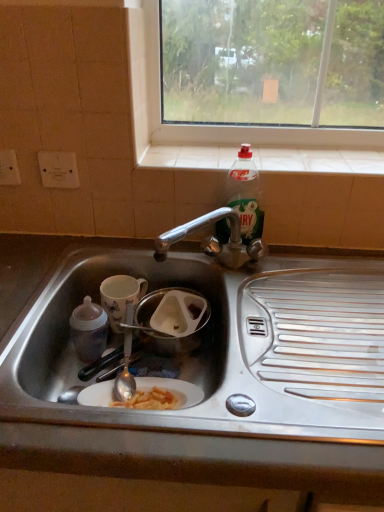
In order to face translucent plastic bottle at upper right, should I rotate leftwards or rightwards?

You should rotate right by 6.714 degrees.

This screenshot has height=512, width=384. What do you see at coordinates (245, 195) in the screenshot? I see `translucent plastic bottle at upper right` at bounding box center [245, 195].

What is the approximate width of porcelain floral mug at sink, which ranks as the first coffee cup in back-to-front order?

4.75 inches.

Locate an element on the screen. translucent plastic bottle at upper right is located at coordinates (245, 195).

Does white tile at upper center have a greater height compared to stainless steel sink at lower left?

In fact, white tile at upper center may be shorter than stainless steel sink at lower left.

Based on the photo, which object is thinner, white tile at upper center or stainless steel sink at lower left?

Thinner between the two is white tile at upper center.

From the picture: Which of these two, white tile at upper center or stainless steel sink at lower left, is smaller?

white tile at upper center.

From a real-world perspective, which is physically above, stainless steel sink at lower left or matte ceramic coffee cup at left, which is the 1th coffee cup from front to back?

matte ceramic coffee cup at left, which is the 1th coffee cup from front to back, from a real-world perspective.

Find the location of a particular element. The image size is (384, 512). the 1st coffee cup counting from the right of the stainless steel sink at lower left is located at coordinates (89, 330).

Is stainless steel sink at lower left smaller than matte ceramic coffee cup at left, which is the 1th coffee cup from front to back?

Actually, stainless steel sink at lower left might be larger than matte ceramic coffee cup at left, which is the 1th coffee cup from front to back.

Between stainless steel sink at lower left and translucent plastic bottle at upper right, which one has larger size?

stainless steel sink at lower left is bigger.

Is stainless steel sink at lower left directly adjacent to translucent plastic bottle at upper right?

No, stainless steel sink at lower left is not in contact with translucent plastic bottle at upper right.

Is point (97, 256) more distant than point (231, 196)?

Yes.

From the image's perspective, is stainless steel sink at lower left above translucent plastic bottle at upper right?

Actually, stainless steel sink at lower left appears below translucent plastic bottle at upper right in the image.

How distant is translucent plastic bottle at upper right from white tile at upper center?

Result: They are 4.81 inches apart.

Considering the positions of point (249, 214) and point (332, 152), is point (249, 214) closer or farther from the camera than point (332, 152)?

Point (249, 214) is positioned closer to the camera compared to point (332, 152).

Can you confirm if translucent plastic bottle at upper right is positioned to the right of white tile at upper center?

No.

The image size is (384, 512). Identify the location of window sill above the translucent plastic bottle at upper right (from the image's perspective). (319, 160).

Is translucent plastic bottle at upper right turned away from porcelain floral mug at sink, which ranks as the first coffee cup in back-to-front order?

No, translucent plastic bottle at upper right is not facing the opposite direction of porcelain floral mug at sink, which ranks as the first coffee cup in back-to-front order.

From a real-world perspective, is translucent plastic bottle at upper right positioned over porcelain floral mug at sink, which ranks as the first coffee cup in back-to-front order, based on gravity?

Indeed, from a real-world perspective, translucent plastic bottle at upper right stands above porcelain floral mug at sink, which ranks as the first coffee cup in back-to-front order.

Does point (259, 196) come closer to viewer compared to point (122, 283)?

Yes, point (259, 196) is closer to viewer.

From the image's perspective, is translucent plastic bottle at upper right above or below porcelain floral mug at sink, the 2th coffee cup when ordered from front to back?

translucent plastic bottle at upper right is above porcelain floral mug at sink, the 2th coffee cup when ordered from front to back.

Could you measure the distance between translucent plastic bottle at upper right and stainless steel sink at lower left?

translucent plastic bottle at upper right and stainless steel sink at lower left are 9.85 inches apart from each other.

In the scene shown: Does translucent plastic bottle at upper right have a greater width compared to stainless steel sink at lower left?

Incorrect, the width of translucent plastic bottle at upper right does not surpass that of stainless steel sink at lower left.

Is translucent plastic bottle at upper right next to stainless steel sink at lower left and touching it?

No, translucent plastic bottle at upper right is not with stainless steel sink at lower left.

Is translucent plastic bottle at upper right completely or partially outside of stainless steel sink at lower left?

Yes.

Is stainless steel sink at lower left completely or partially outside of porcelain floral mug at sink, the 2th coffee cup when ordered from front to back?

Indeed, stainless steel sink at lower left is completely outside porcelain floral mug at sink, the 2th coffee cup when ordered from front to back.

Does stainless steel sink at lower left have a smaller size compared to porcelain floral mug at sink, the 2th coffee cup when ordered from front to back?

Incorrect, stainless steel sink at lower left is not smaller in size than porcelain floral mug at sink, the 2th coffee cup when ordered from front to back.

Does stainless steel sink at lower left have a greater height compared to porcelain floral mug at sink, which ranks as the first coffee cup in back-to-front order?

Indeed, stainless steel sink at lower left has a greater height compared to porcelain floral mug at sink, which ranks as the first coffee cup in back-to-front order.

In the scene shown: Is stainless steel sink at lower left next to porcelain floral mug at sink, which ranks as the first coffee cup in back-to-front order, and touching it?

No.

At what (x,y) coordinates should I click in order to perform the action: click on window sill that appears above the stainless steel sink at lower left (from the image's perspective). Please return your answer as a coordinate pair (x, y). The width and height of the screenshot is (384, 512). Looking at the image, I should click on (319, 160).

The image size is (384, 512). In order to click on sink below the matte ceramic coffee cup at left, which is counted as the second coffee cup, starting from the back (from the image's perspective) in this screenshot , I will do `click(217, 343)`.

Looking at the image, which one is located closer to stainless steel sink at lower left, porcelain floral mug at sink, which ranks as the first coffee cup in back-to-front order, or translucent plastic bottle at upper right?

porcelain floral mug at sink, which ranks as the first coffee cup in back-to-front order, is positioned closer to the anchor stainless steel sink at lower left.

From the image, which object appears to be nearer to matte ceramic coffee cup at left, which is counted as the second coffee cup, starting from the back, porcelain floral mug at sink, the 2th coffee cup when ordered from front to back, or white tile at upper center?

porcelain floral mug at sink, the 2th coffee cup when ordered from front to back, is closer to matte ceramic coffee cup at left, which is counted as the second coffee cup, starting from the back.

Considering their positions, is white tile at upper center positioned closer to stainless steel sink at lower left than matte ceramic coffee cup at left, which is the 1th coffee cup from front to back?

matte ceramic coffee cup at left, which is the 1th coffee cup from front to back, is closer to stainless steel sink at lower left.

From the image, which object appears to be nearer to porcelain floral mug at sink, the 2th coffee cup when ordered from front to back, stainless steel sink at lower left or translucent plastic bottle at upper right?

Among the two, stainless steel sink at lower left is located nearer to porcelain floral mug at sink, the 2th coffee cup when ordered from front to back.

Based on their spatial positions, is white tile at upper center or porcelain floral mug at sink, which ranks as the first coffee cup in back-to-front order, further from stainless steel sink at lower left?

The object further to stainless steel sink at lower left is white tile at upper center.

Estimate the real-world distances between objects in this image. Which object is further from translucent plastic bottle at upper right, matte ceramic coffee cup at left, which is counted as the second coffee cup, starting from the back, or stainless steel sink at lower left?

matte ceramic coffee cup at left, which is counted as the second coffee cup, starting from the back, is positioned further to the anchor translucent plastic bottle at upper right.

Estimate the real-world distances between objects in this image. Which object is further from porcelain floral mug at sink, the 2th coffee cup when ordered from front to back, matte ceramic coffee cup at left, which is the 1th coffee cup from front to back, or translucent plastic bottle at upper right?

Among the two, translucent plastic bottle at upper right is located further to porcelain floral mug at sink, the 2th coffee cup when ordered from front to back.

Estimate the real-world distances between objects in this image. Which object is further from white tile at upper center, porcelain floral mug at sink, the 2th coffee cup when ordered from front to back, or matte ceramic coffee cup at left, which is counted as the second coffee cup, starting from the back?

matte ceramic coffee cup at left, which is counted as the second coffee cup, starting from the back, is further to white tile at upper center.

The height and width of the screenshot is (512, 384). In order to click on coffee cup between matte ceramic coffee cup at left, which is the 1th coffee cup from front to back, and translucent plastic bottle at upper right, in the horizontal direction in this screenshot , I will do `click(120, 296)`.

Locate an element on the screen. coffee cup that lies between porcelain floral mug at sink, the 2th coffee cup when ordered from front to back, and stainless steel sink at lower left from top to bottom is located at coordinates (89, 330).

Identify the location of bottle between matte ceramic coffee cup at left, which is counted as the second coffee cup, starting from the back, and white tile at upper center from left to right. The height and width of the screenshot is (512, 384). (245, 195).

This screenshot has width=384, height=512. I want to click on bottle between porcelain floral mug at sink, which ranks as the first coffee cup in back-to-front order, and white tile at upper center from left to right, so click(x=245, y=195).